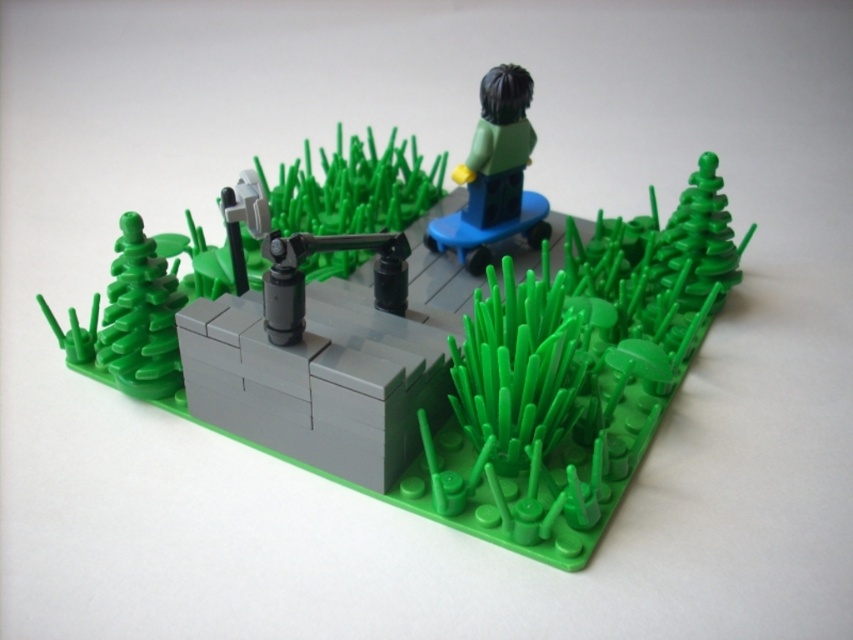
Looking at this image, does smooth gray platform at center appear on the right side of green matte figure at upper center?

In fact, smooth gray platform at center is to the left of green matte figure at upper center.

At what (x,y) coordinates should I click in order to perform the action: click on smooth gray platform at center. Please return your answer as a coordinate pair (x, y). This screenshot has width=853, height=640. Looking at the image, I should click on (421, 365).